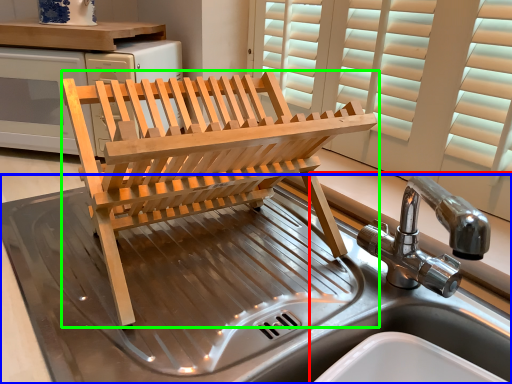
Question: Which object is positioned farthest from sink (highlighted by a red box)? Select from sink (highlighted by a blue box) and furniture (highlighted by a green box).

Choices:
 (A) sink
 (B) furniture

Answer: (A)